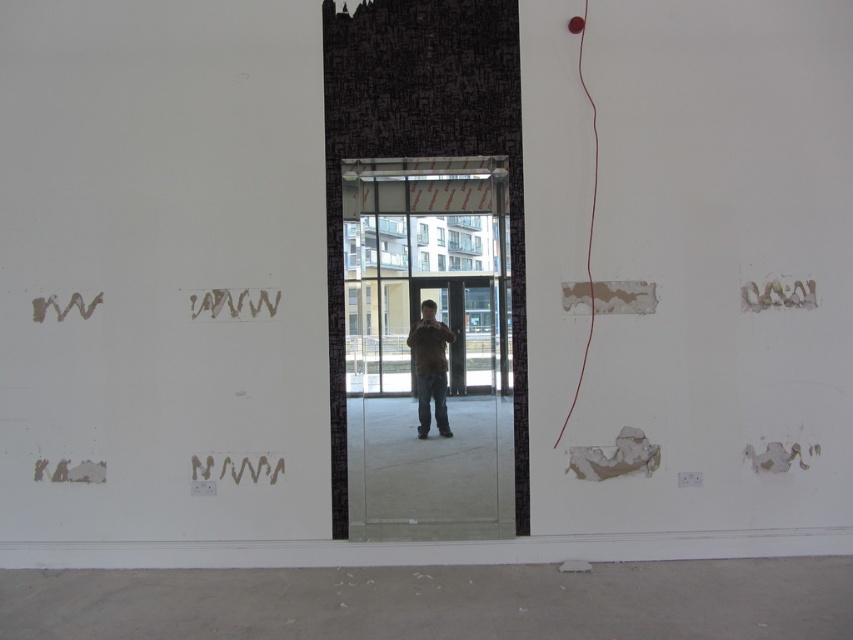
Question: Can you confirm if transparent glass door at center is positioned above wavy paper at lower center?

Choices:
 (A) yes
 (B) no

Answer: (A)

Question: Which point is farther from the camera taking this photo?

Choices:
 (A) pyautogui.click(x=432, y=396)
 (B) pyautogui.click(x=397, y=492)

Answer: (A)

Question: Can you confirm if red matte string at right is bigger than wavy paper at lower center?

Choices:
 (A) yes
 (B) no

Answer: (A)

Question: Which point is farther from the camera taking this photo?

Choices:
 (A) (252, 298)
 (B) (576, 32)
 (C) (434, 403)
 (D) (258, 467)

Answer: (C)

Question: Which object appears closest to the camera in this image?

Choices:
 (A) wavy paper at lower center
 (B) brown leather jacket at center
 (C) transparent glass door at center

Answer: (A)

Question: In this image, where is transparent glass door at center located relative to red matte string at right?

Choices:
 (A) above
 (B) below

Answer: (B)